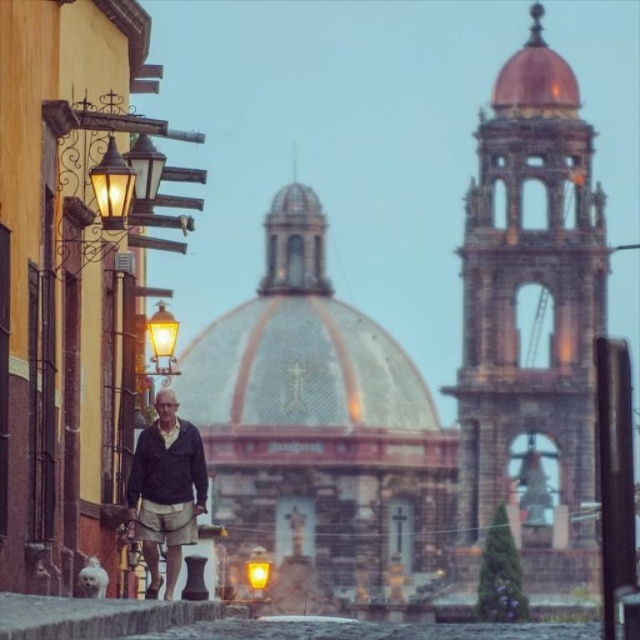
You are a photographer trying to capture the man in the dark gray jacket at center. Where should you focus your camera to ensure the jacket is in the frame?

You should focus your camera at point (166, 490) to ensure the dark gray jacket at center is in the frame.

You are standing at the center of the cobblestone street in the image and want to locate the matte gold streetlamp at left. According to the coordinates provided, in which direction should you look to find it?

The matte gold streetlamp at left is located at coordinates point (161, 342). Since you are standing at the center, looking towards the left side of the image would allow you to find the matte gold streetlamp at left.